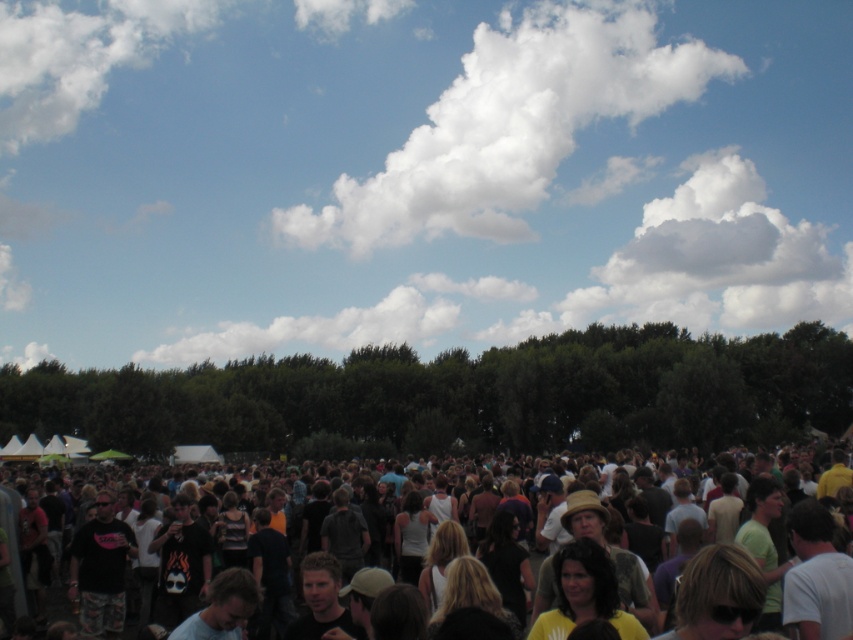
You are a photographer trying to capture the entire scene of the festival. You notice the white fluffy cloud at upper center and the dark clothing crowd at center. Which object appears taller in the image?

The white fluffy cloud at upper center appears taller than the dark clothing crowd at center in the image.

You are an event planner trying to estimate the visibility of the sky during the event. Given that the white fluffy cloud at upper center and the dark clothing crowd at center are both present, which one takes up more space in the image?

The white fluffy cloud at upper center takes up more space in the image because it has a larger size compared to the dark clothing crowd at center.